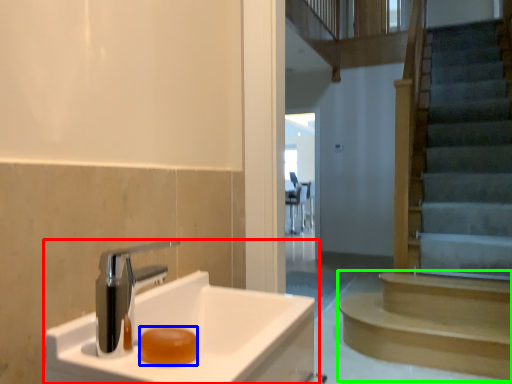
Question: Estimate the real-world distances between objects in this image. Which object is farther from sink (highlighted by a red box), soap (highlighted by a blue box) or stairs (highlighted by a green box)?

Choices:
 (A) soap
 (B) stairs

Answer: (B)